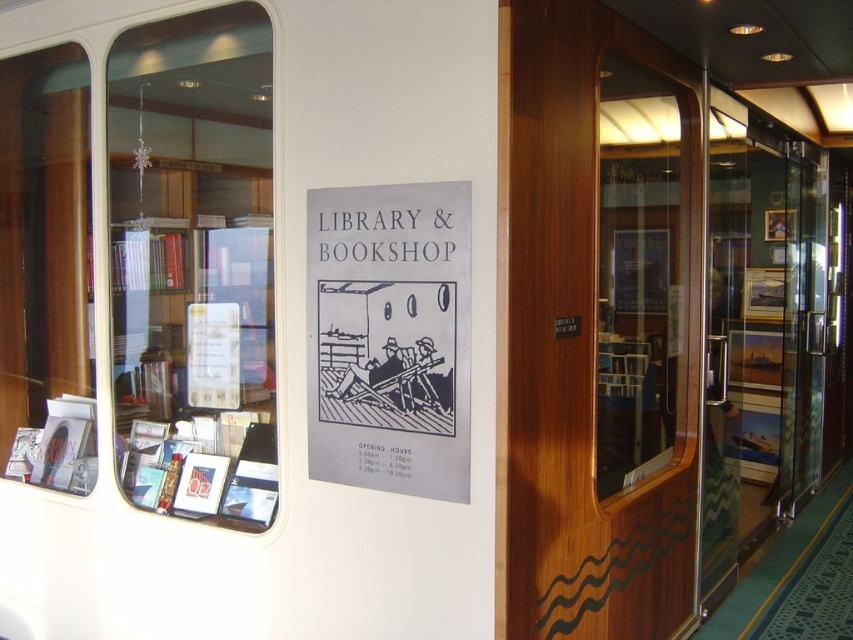
You are a visitor in this ship library. You want to exit the current room and need to find the door. You see the wooden door at center and the clear glass window at left. Which one is to the right of the other?

The wooden door at center is positioned on the right side of clear glass window at left.

You are a visitor in the library and want to exit to the main deck. The wooden door at center and the clear glass window at left are in your view. Which one should you approach to exit?

The wooden door at center is located below the clear glass window at left, so you should approach the wooden door at center to exit since doors typically lead to exits rather than windows.

You are a customer entering the library and see the transparent glass door at center and the matte plastic book at lower left. Which object is larger in size?

The transparent glass door at center is bigger than the matte plastic book at lower left.